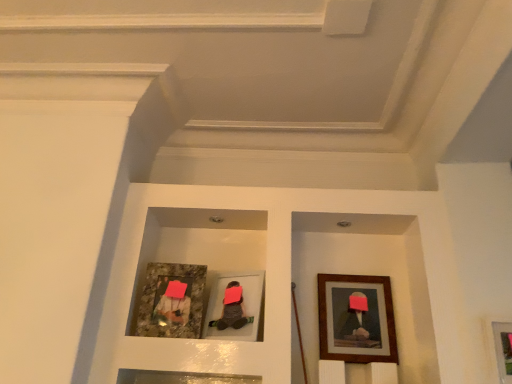
Question: Is point (251, 296) positioned closer to the camera than point (325, 301)?

Choices:
 (A) farther
 (B) closer

Answer: (B)

Question: In terms of height, does matte gray picture frame at center, positioned as the second picture frame in left-to-right order, look taller or shorter compared to wooden framed artwork at right, the 3th picture frame in the left-to-right sequence?

Choices:
 (A) tall
 (B) short

Answer: (B)

Question: Which is nearer to the matte gray picture frame at center, the third picture frame from the right?

Choices:
 (A) granite-like frame at left, placed as the fourth picture frame when sorted from right to left
 (B) wooden framed picture at lower right, which is the 1th picture frame from right to left
 (C) wooden framed artwork at right, which is the 2th picture frame in right-to-left order

Answer: (A)

Question: Estimate the real-world distances between objects in this image. Which object is farther from the wooden framed picture at lower right, which is the 1th picture frame from right to left?

Choices:
 (A) granite-like frame at left, arranged as the 1th picture frame when viewed from the left
 (B) matte gray picture frame at center, the third picture frame from the right
 (C) wooden framed artwork at right, the 3th picture frame in the left-to-right sequence

Answer: (A)